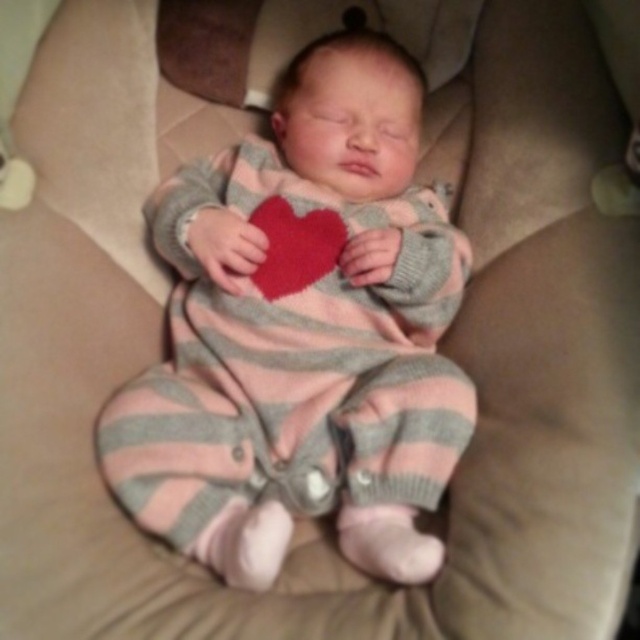
You are a photographer trying to capture the baby in the center of the image. Given that the image has a coordinate system where the bottom left corner is the origin point, can you determine if the point at coordinates point (301,333) is the best position to focus on to ensure the baby is centered?

The point (301,333) marks the knitted pink gray baby at center, so yes, focusing on this point will ensure the baby is centered in the image.